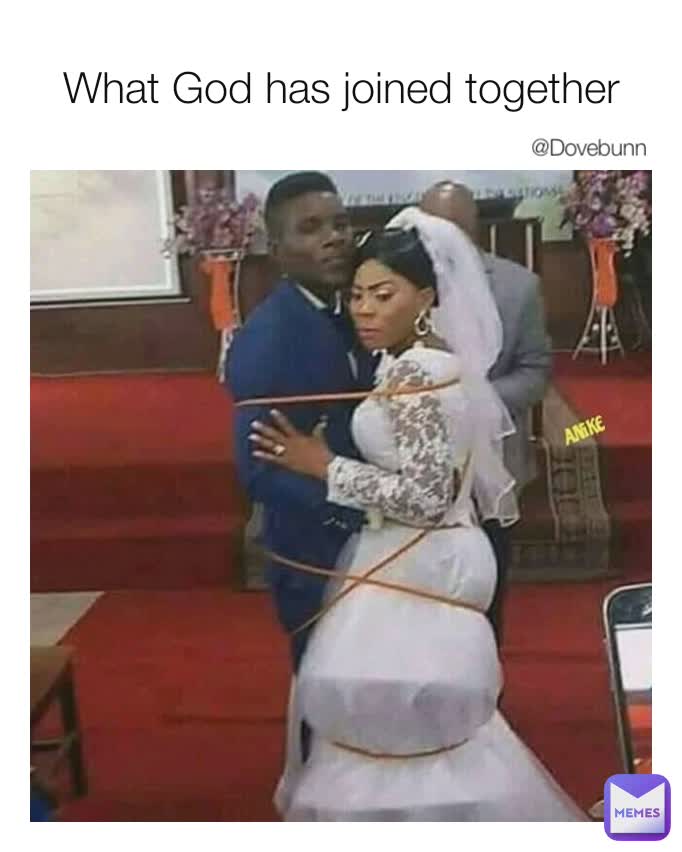
This screenshot has height=852, width=682. I want to click on area rug, so click(x=567, y=513).